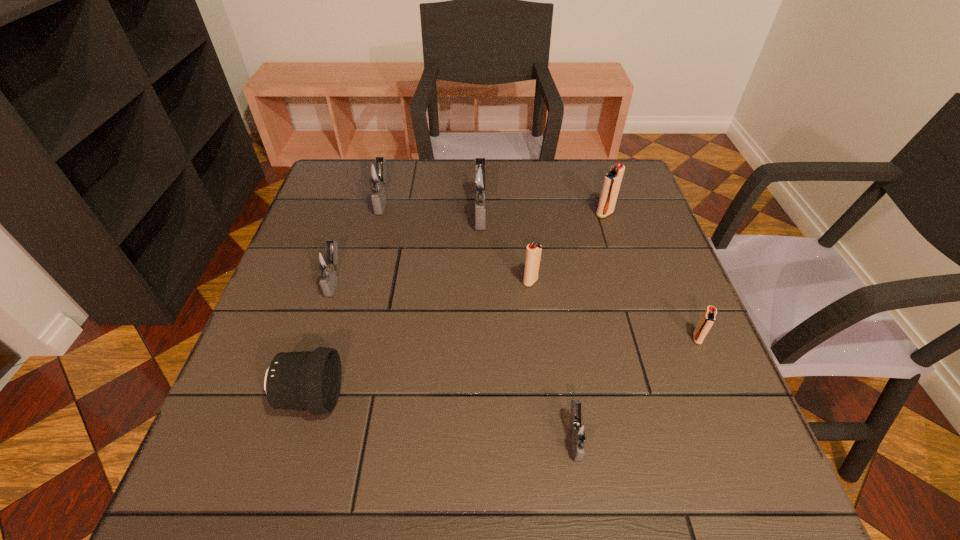
At what (x,y) coordinates should I click in order to perform the action: click on free spot between the smallest gray igniter and the tallest object. Please return your answer as a coordinate pair (x, y). This screenshot has width=960, height=540. Looking at the image, I should click on 528,325.

Identify which object is the closest to the nearest igniter. Please provide its 2D coordinates. Your answer should be formatted as a tuple, i.e. [(x, y)], where the tuple contains the x and y coordinates of a point satisfying the conditions above.

[(706, 322)]

You are a GUI agent. You are given a task and a screenshot of the screen. Output one action in this format:
    pyautogui.click(x=<x>, y=<y>)
    Task: Click on the object that stands as the seventh closest to the telephoto lens
    The image size is (960, 540).
    Given the screenshot: What is the action you would take?
    coord(612,180)

Locate an element on the screen. the closest igniter to the farthest red igniter is located at coordinates (480, 178).

Find the location of a particular element. igniter object that ranks as the closest to the black telephoto lens is located at coordinates (325, 261).

I want to click on gray igniter identified as the fourth closest to the second object from right to left, so click(325, 261).

Select which gray igniter appears as the third closest to the black telephoto lens. Please provide its 2D coordinates. Your answer should be formatted as a tuple, i.e. [(x, y)], where the tuple contains the x and y coordinates of a point satisfying the conditions above.

[(480, 178)]

Identify which red igniter is the third nearest to the second nearest gray igniter. Please provide its 2D coordinates. Your answer should be formatted as a tuple, i.e. [(x, y)], where the tuple contains the x and y coordinates of a point satisfying the conditions above.

[(706, 322)]

Choose which red igniter is the second nearest neighbor to the third gray igniter from left to right. Please provide its 2D coordinates. Your answer should be formatted as a tuple, i.e. [(x, y)], where the tuple contains the x and y coordinates of a point satisfying the conditions above.

[(612, 180)]

The image size is (960, 540). Identify the location of vacant position in the image that satisfies the following two spatial constraints: 1. on the back side of the second object from right to left; 2. on the right side of the rightmost gray igniter. (540, 214).